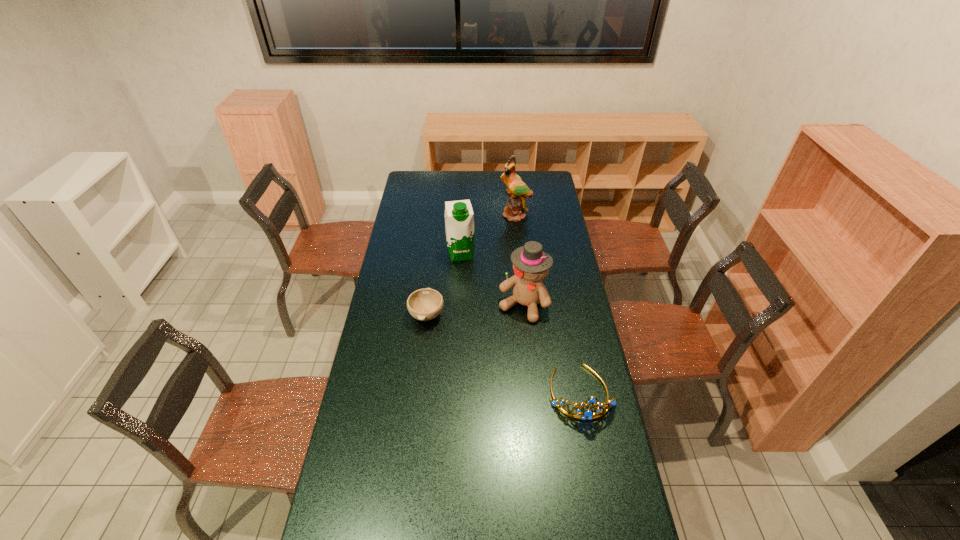
I want to click on vacant space situated on the front-facing side of the farthest object, so click(511, 239).

Where is `free space located 0.360m on the front-facing side of the farthest object`? Image resolution: width=960 pixels, height=540 pixels. free space located 0.360m on the front-facing side of the farthest object is located at coordinates (505, 266).

I want to click on vacant space located 0.290m on the front-facing side of the rag_doll, so click(x=485, y=375).

The width and height of the screenshot is (960, 540). I want to click on vacant space situated on the front-facing side of the rag_doll, so click(487, 370).

At what (x,y) coordinates should I click in order to perform the action: click on vacant space positioned 0.060m on the front-facing side of the rag_doll. Please return your answer as a coordinate pair (x, y). Looking at the image, I should click on (509, 332).

Locate an element on the screen. Image resolution: width=960 pixels, height=540 pixels. vacant region located on the front-facing side of the soya milk is located at coordinates (475, 321).

The width and height of the screenshot is (960, 540). Identify the location of vacant space located 0.090m on the front-facing side of the soya milk. (466, 275).

Locate an element on the screen. The width and height of the screenshot is (960, 540). blank space located 0.380m on the front-facing side of the soya milk is located at coordinates (475, 321).

I want to click on object that is positioned at the left edge, so click(x=425, y=304).

Identify the location of tiara at the right edge. Image resolution: width=960 pixels, height=540 pixels. (588, 414).